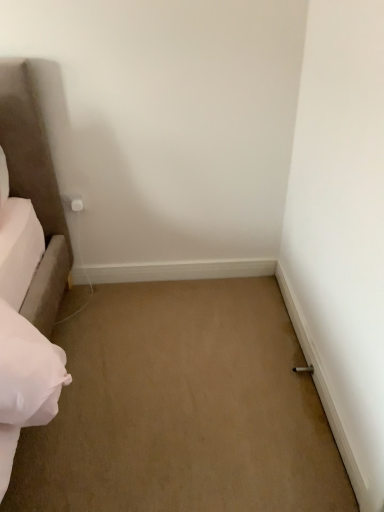
Locate an element on the screen. beige carpet at center is located at coordinates (182, 409).

The width and height of the screenshot is (384, 512). Describe the element at coordinates (182, 409) in the screenshot. I see `beige carpet at center` at that location.

Find the location of `beige carpet at center`. beige carpet at center is located at coordinates (182, 409).